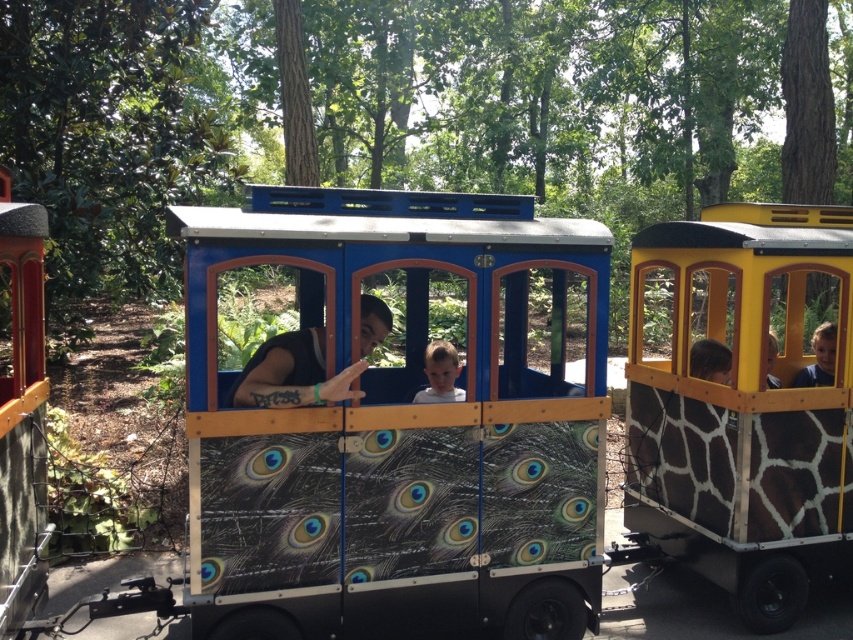
Can you confirm if black matte shirt at center is wider than smooth brown hair at right?

Correct, the width of black matte shirt at center exceeds that of smooth brown hair at right.

Can you confirm if black matte shirt at center is shorter than smooth brown hair at right?

No.

Who is more forward, (303, 337) or (828, 353)?

Point (303, 337)

In order to click on black matte shirt at center in this screenshot , I will do `click(306, 364)`.

Who is taller, smooth brown hair at right or light brown wooden face at center?

smooth brown hair at right is taller.

Between smooth brown hair at right and light brown wooden face at center, which one appears on the right side from the viewer's perspective?

From the viewer's perspective, smooth brown hair at right appears more on the right side.

This screenshot has height=640, width=853. Find the location of `smooth brown hair at right`. smooth brown hair at right is located at coordinates (819, 358).

This screenshot has height=640, width=853. What are the coordinates of `smooth brown hair at right` in the screenshot? It's located at (819, 358).

Is peacock feather wallpapered wagon at center taller than smooth brown hair at right?

No, peacock feather wallpapered wagon at center is not taller than smooth brown hair at right.

Does peacock feather wallpapered wagon at center have a lesser width compared to smooth brown hair at right?

No.

Is point (396, 621) behind point (815, 385)?

No, it is not.

Where is `peacock feather wallpapered wagon at center`? Image resolution: width=853 pixels, height=640 pixels. peacock feather wallpapered wagon at center is located at coordinates [393, 417].